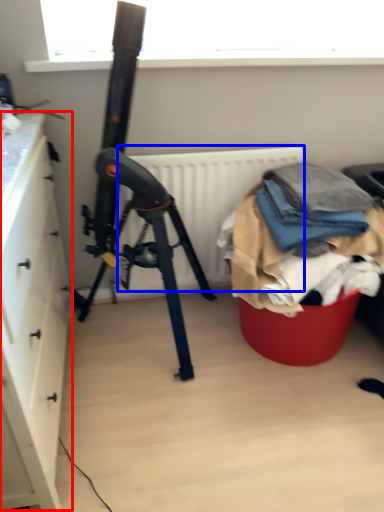
Question: Which object appears farthest to the camera in this image, cabinetry (highlighted by a red box) or radiator (highlighted by a blue box)?

Choices:
 (A) cabinetry
 (B) radiator

Answer: (B)